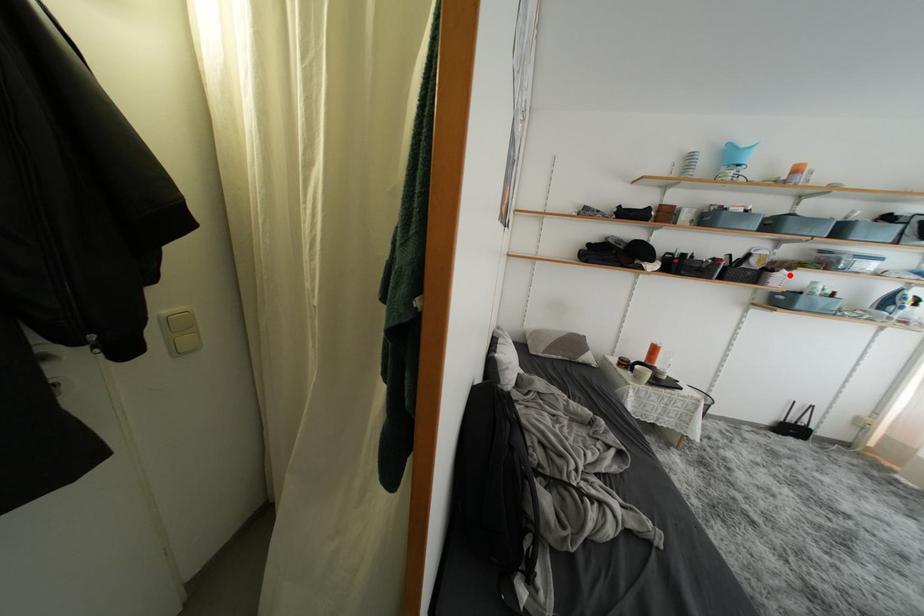
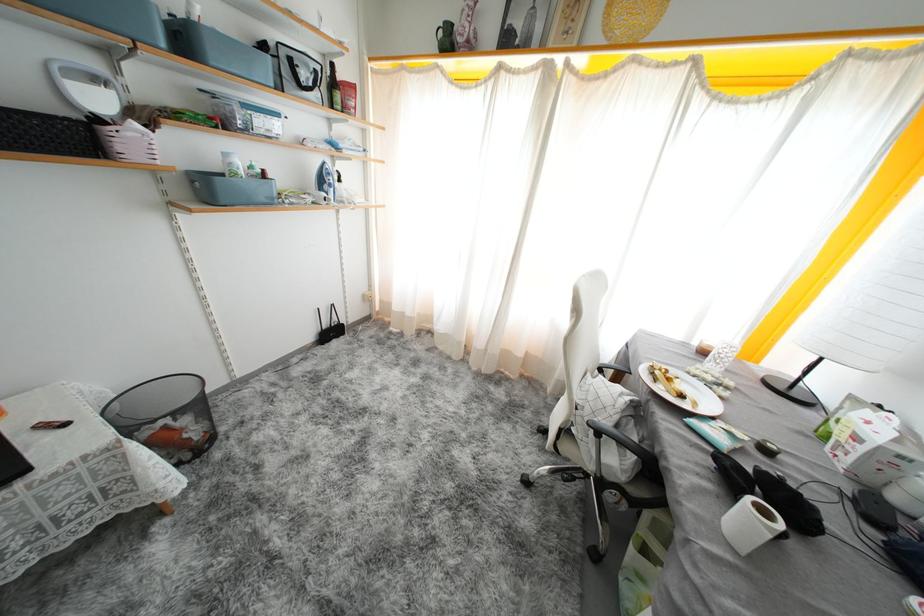
The point at the highlighted location is marked in the first image. Where is the corresponding point in the second image?

(141, 129)